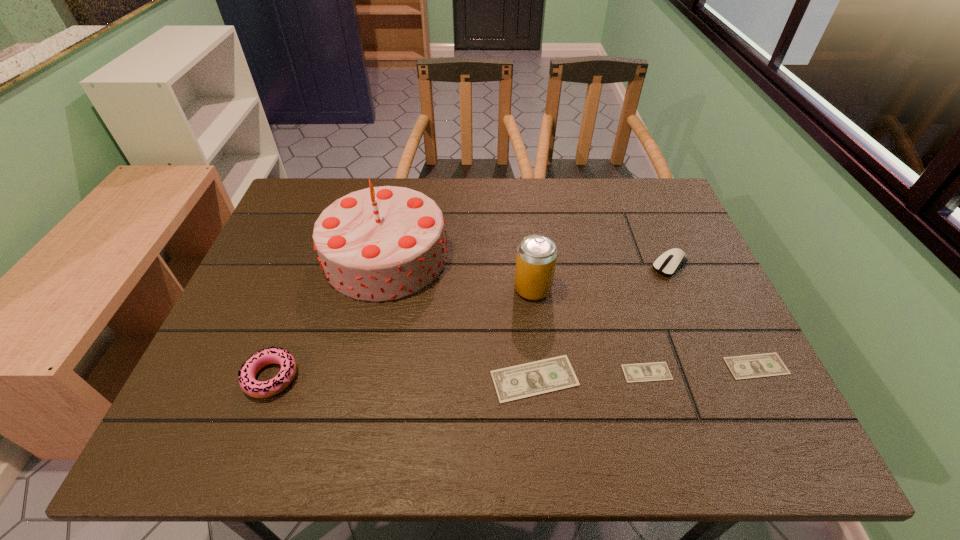
Where is `the fifth tallest object`? This screenshot has height=540, width=960. the fifth tallest object is located at coordinates (517, 382).

Identify the location of the leftmost money. This screenshot has height=540, width=960. (517, 382).

Locate an element on the screen. the shortest object is located at coordinates (657, 371).

Image resolution: width=960 pixels, height=540 pixels. I want to click on the shortest money, so click(x=657, y=371).

The image size is (960, 540). Find the location of `the rightmost money`. the rightmost money is located at coordinates (769, 364).

Where is `the second tallest money`? the second tallest money is located at coordinates (769, 364).

Where is `mouse`? Image resolution: width=960 pixels, height=540 pixels. mouse is located at coordinates (668, 263).

Identify the location of the tallest object. The image size is (960, 540). click(382, 243).

You are a GUI agent. You are given a task and a screenshot of the screen. Output one action in this format:
    pyautogui.click(x=<x>, y=<y>)
    Task: Click on the pop (soda)
    The width and height of the screenshot is (960, 540).
    Given the screenshot: What is the action you would take?
    pyautogui.click(x=536, y=258)

Locate an element on the screen. Image resolution: width=960 pixels, height=540 pixels. doughnut is located at coordinates 258,389.